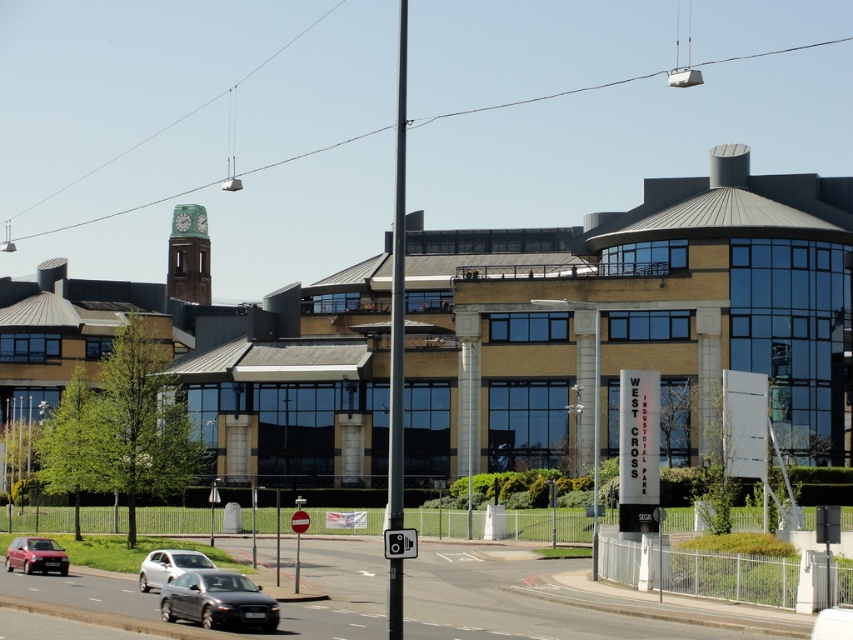
Question: Can you confirm if dark gray metallic car at lower center is wider than silver metallic hatchback at lower left?

Choices:
 (A) yes
 (B) no

Answer: (B)

Question: Which point is farther from the camera taking this photo?

Choices:
 (A) (163, 564)
 (B) (247, 621)

Answer: (A)

Question: Which is farther from the silver metallic sedan at lower left?

Choices:
 (A) dark gray metallic car at lower center
 (B) silver metallic hatchback at lower left

Answer: (A)

Question: Can you confirm if dark gray metallic car at lower center is thinner than silver metallic hatchback at lower left?

Choices:
 (A) no
 (B) yes

Answer: (B)

Question: Which of the following is the farthest from the observer?

Choices:
 (A) silver metallic hatchback at lower left
 (B) dark gray metallic car at lower center

Answer: (A)

Question: Is silver metallic hatchback at lower left wider than silver metallic sedan at lower left?

Choices:
 (A) yes
 (B) no

Answer: (A)